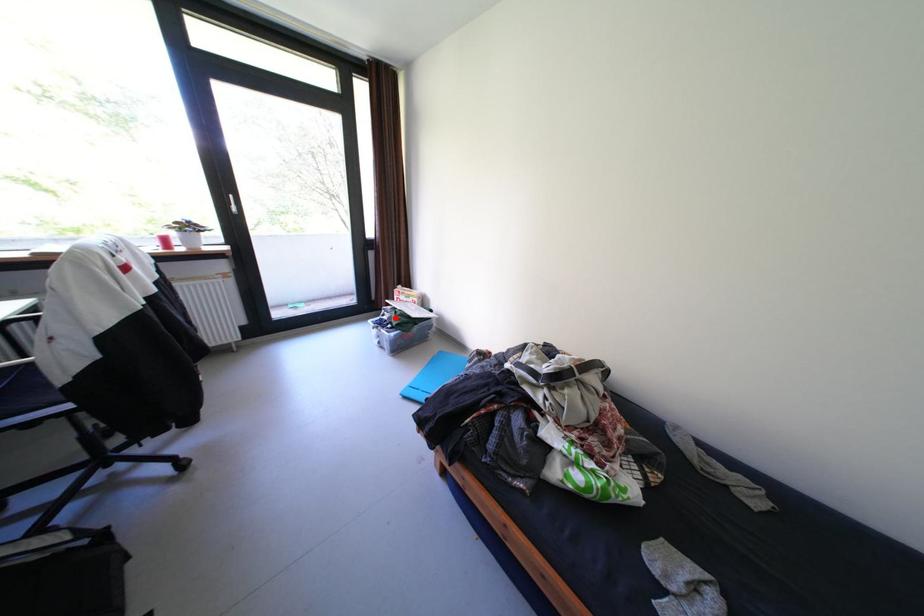
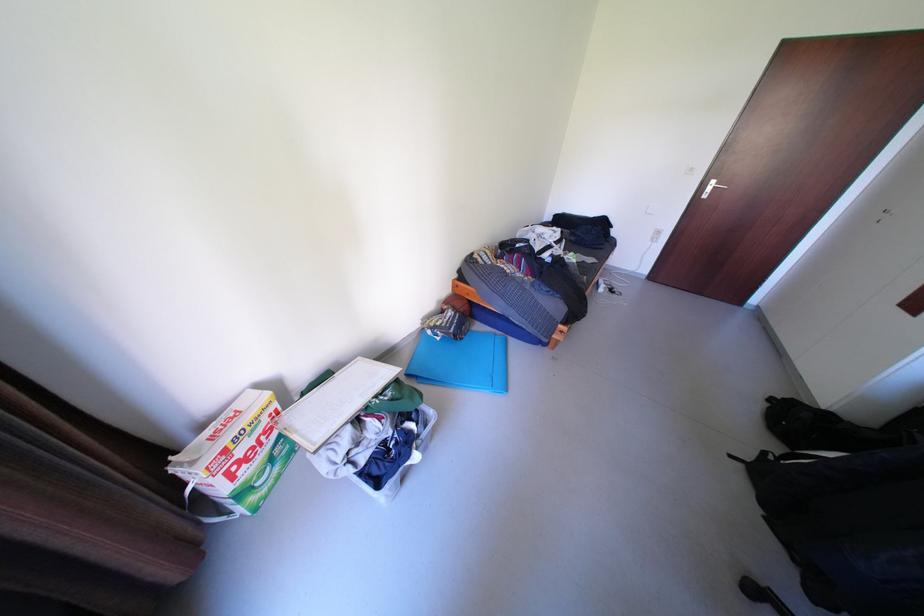
Find the pixel in the second image that matches the highlighted location in the first image.

(372, 459)